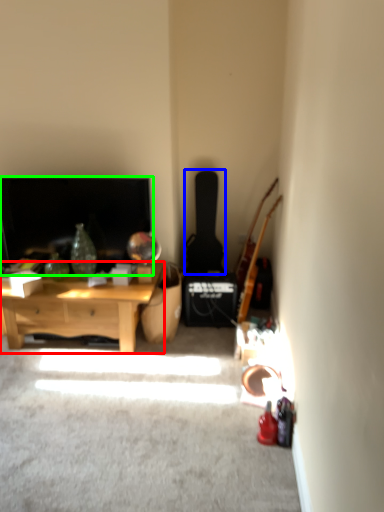
Question: Which object is the farthest from desk (highlighted by a red box)? Choose among these: guitar (highlighted by a blue box) or fireplace (highlighted by a green box).

Choices:
 (A) guitar
 (B) fireplace

Answer: (A)